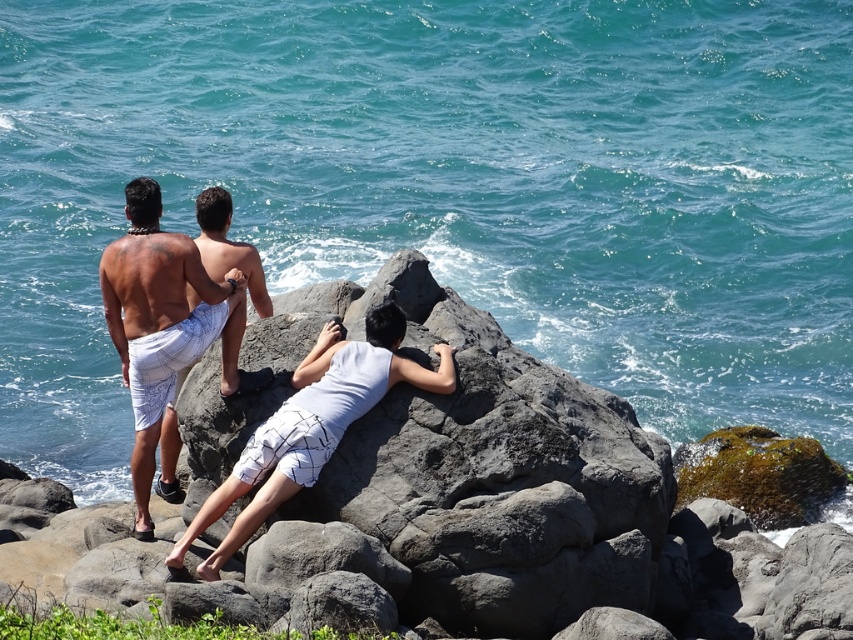
You are a photographer standing at the camera position in this coastal scene. You want to capture a closeup shot of the gray rough rock at center. Considering your current position, do you think you can take the photo without moving closer? Please explain your reasoning based on the distance provided.

The gray rough rock at center is 34.61 meters away from the camera. At this distance, it would be challenging to capture a clear closeup shot without moving closer, as most standard camera lenses struggle to focus effectively beyond 30 meters without zoom capabilities. Therefore, you would need to move closer to achieve a sharp closeup.

You are a photographer trying to capture the scene from the shore. You notice the white printed shorts at left and the white textured shorts at center. Which pair of shorts is closer to the camera?

The white printed shorts at left is below the white textured shorts at center, meaning it is closer to the camera.